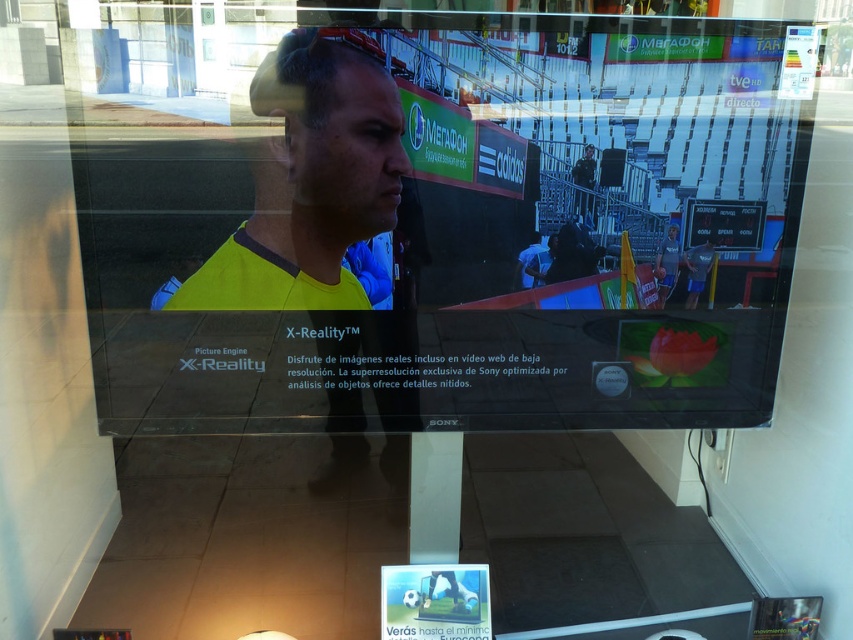
You are a photographer who wants to capture the advertisement on the matte black tv at center and the yellow matte shirt at center. Since you want to ensure both are in focus, which object should you focus on first to account for their sizes?

Since the matte black tv at center is larger than the yellow matte shirt at center, you should focus on the matte black tv at center first to ensure both are in focus.

You are standing in front of the Sony X Reality TV display. You notice a matte black tv at center and a yellow matte shirt at center. Which object is positioned to the right side of the other?

The matte black tv at center is to the right of the yellow matte shirt at center.

What is the location of the point with coordinates (457, 234) in the image?

The point with coordinates (457, 234) is located on the matte black TV at center.